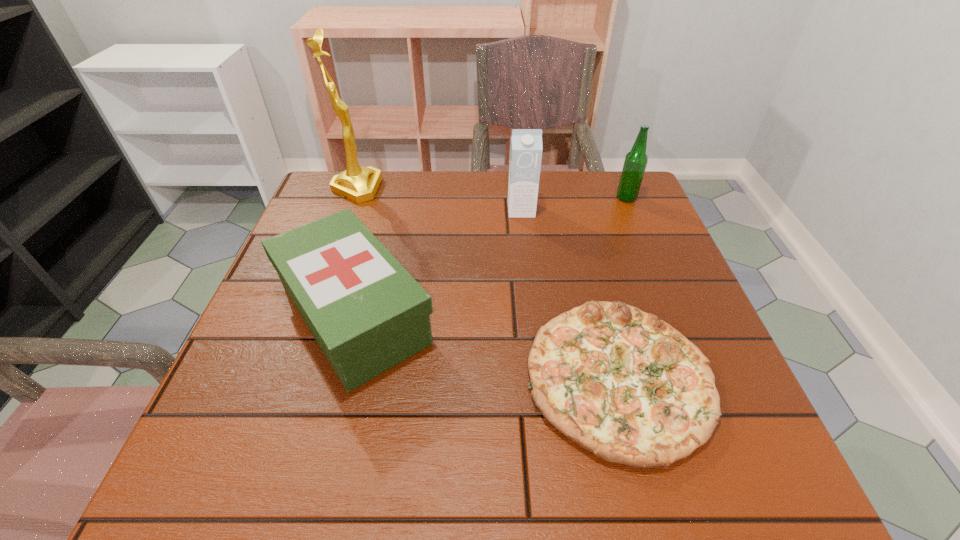
The height and width of the screenshot is (540, 960). I want to click on object that is at the far left corner, so click(x=359, y=184).

Where is `object at the far right corner`? object at the far right corner is located at coordinates (636, 160).

Identify the location of object at the near right corner. (629, 388).

Image resolution: width=960 pixels, height=540 pixels. I want to click on vacant region at the far edge of the desktop, so click(403, 188).

I want to click on vacant space at the near edge, so [x=443, y=465].

The image size is (960, 540). In the image, there is a desktop. What are the coordinates of `vacant space at the left edge` in the screenshot? It's located at pyautogui.click(x=284, y=314).

Locate an element on the screen. The image size is (960, 540). free location at the right edge is located at coordinates (679, 295).

This screenshot has height=540, width=960. Find the location of `vacant region at the near left corner`. vacant region at the near left corner is located at coordinates pos(211,465).

In the image, there is a desktop. Where is `free space at the far right corner`? The width and height of the screenshot is (960, 540). free space at the far right corner is located at coordinates (624, 202).

The image size is (960, 540). In order to click on empty space that is in between the pizza and the carton in this screenshot , I will do `click(570, 294)`.